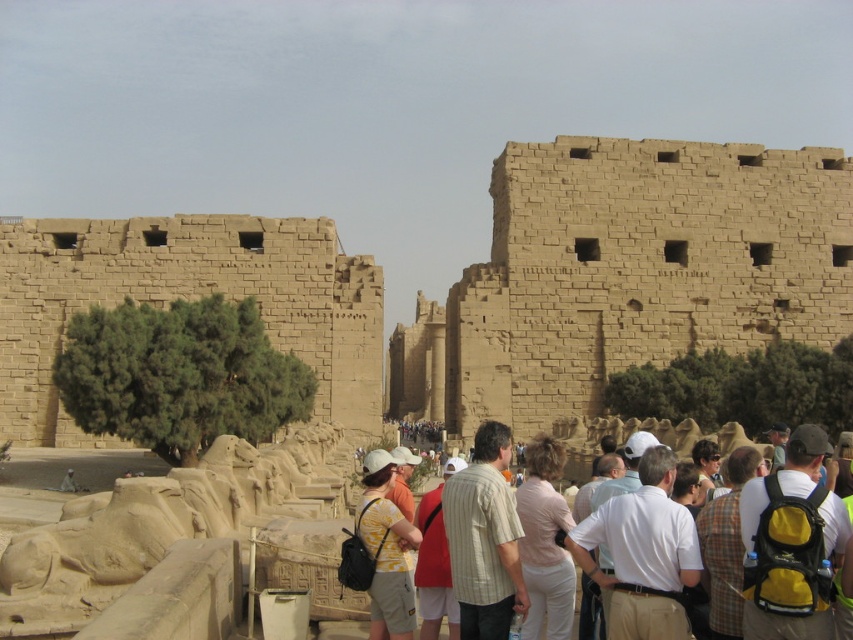
Question: Among these points, which one is nearest to the camera?

Choices:
 (A) (384, 596)
 (B) (759, 461)
 (C) (280, 252)
 (D) (805, 452)

Answer: (A)

Question: Considering the relative positions of sandstone wall at center and yellow printed shirt at center in the image provided, where is sandstone wall at center located with respect to yellow printed shirt at center?

Choices:
 (A) right
 (B) left

Answer: (A)

Question: Which object appears closest to the camera in this image?

Choices:
 (A) red fabric shirt at center
 (B) pink fabric shirt at center

Answer: (B)

Question: Is yellow printed shirt at center above light brown fabric crowd at center?

Choices:
 (A) yes
 (B) no

Answer: (B)

Question: Which object is closer to the camera taking this photo?

Choices:
 (A) sandstone wall at center
 (B) pink fabric shirt at center
 (C) plaid fabric shirt at center-right

Answer: (C)

Question: Is the position of brown textured stone wall at left less distant than that of striped cotton shirt at center?

Choices:
 (A) yes
 (B) no

Answer: (B)